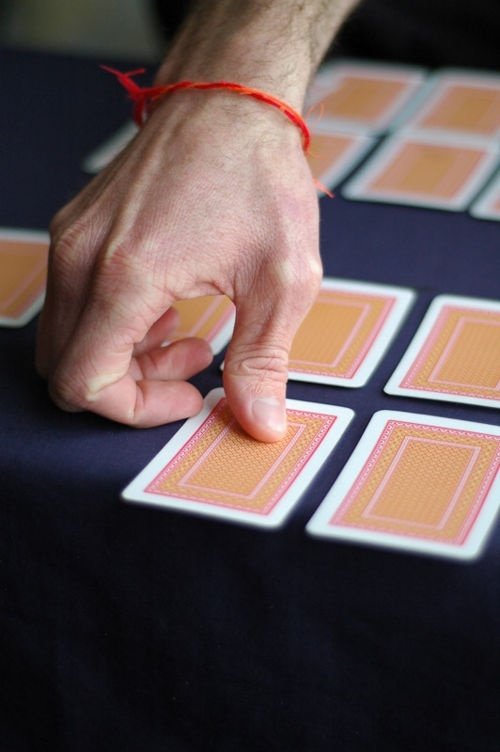
Where is `blue table cloth`? The height and width of the screenshot is (752, 500). blue table cloth is located at coordinates (61, 132).